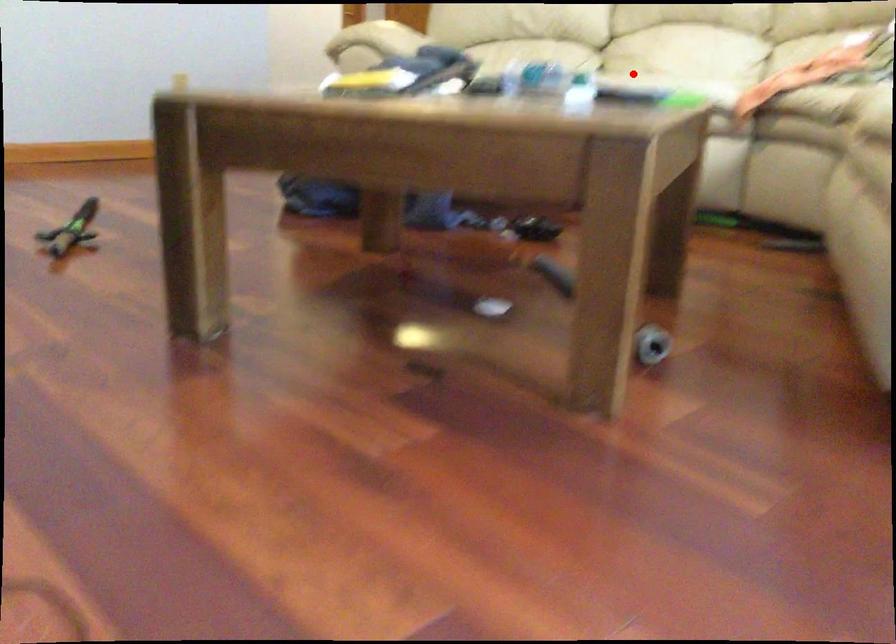
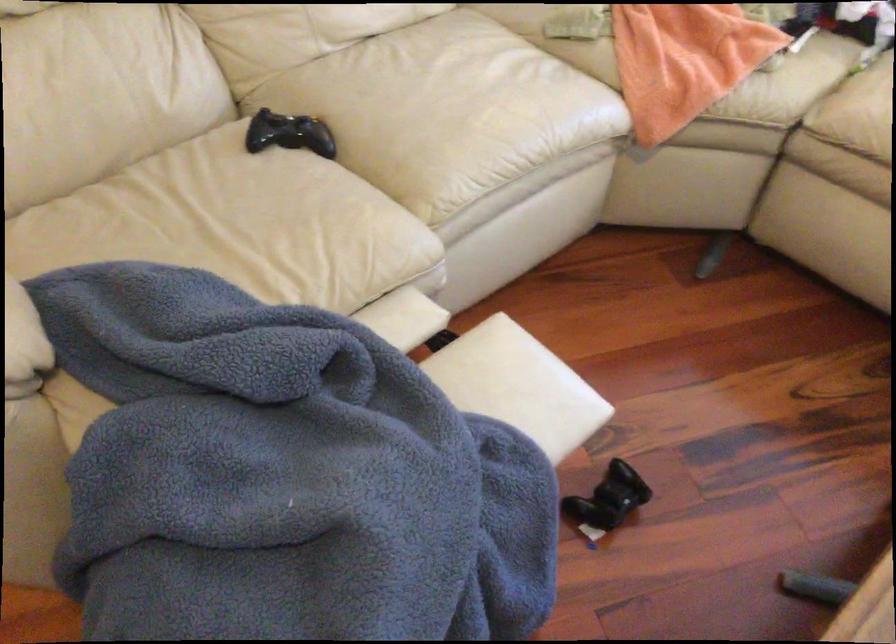
Find the pixel in the second image that matches the highlighted location in the first image.

(446, 109)